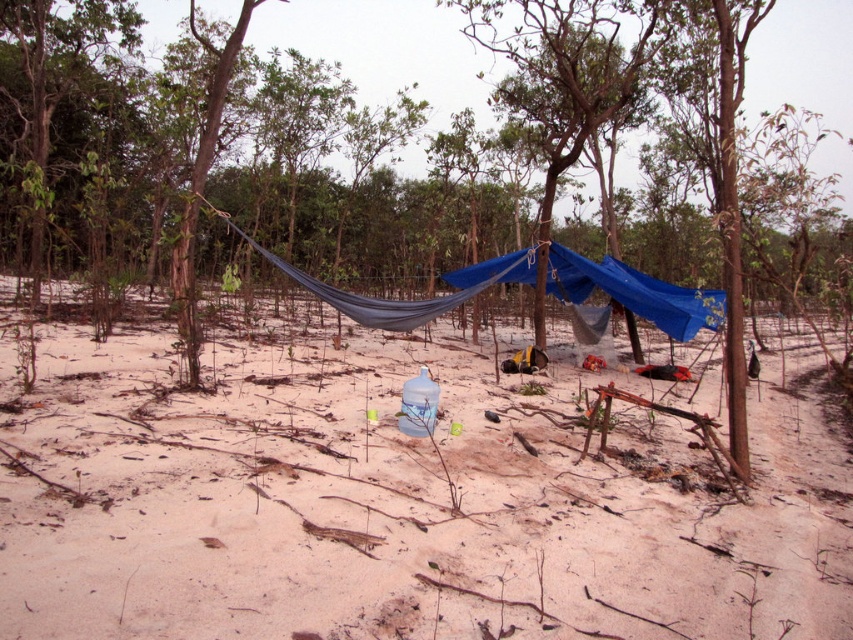
Consider the image. Who is lower down, white sandy ground at center or blue fabric canopy at center?

white sandy ground at center

Can you confirm if white sandy ground at center is taller than blue fabric canopy at center?

In fact, white sandy ground at center may be shorter than blue fabric canopy at center.

The height and width of the screenshot is (640, 853). Find the location of `white sandy ground at center`. white sandy ground at center is located at coordinates (397, 500).

Image resolution: width=853 pixels, height=640 pixels. In order to click on white sandy ground at center in this screenshot , I will do `click(397, 500)`.